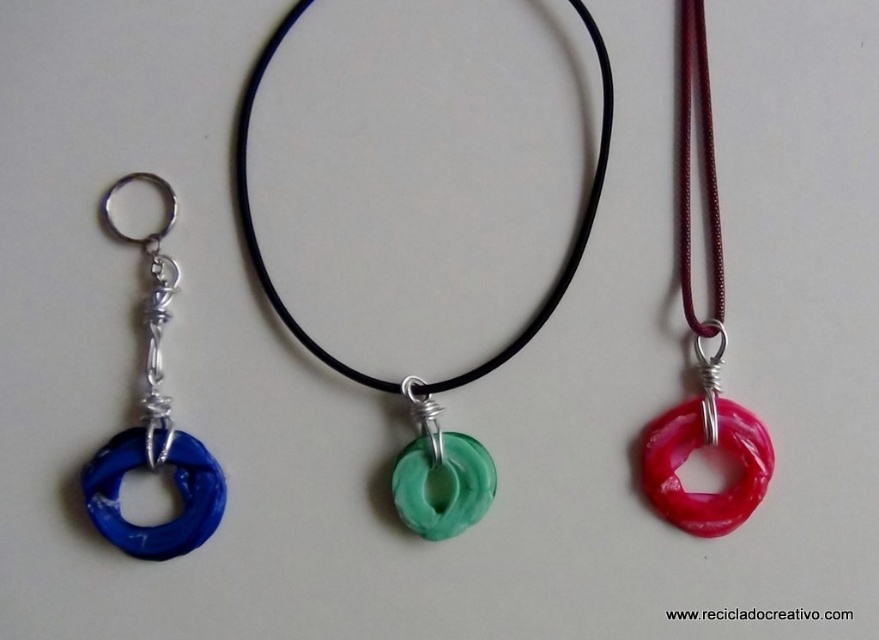
You are an online buyer who wants to know if the green translucent ring at center will fit through the loop of the blue plastic ring at left. Based on their sizes, can you determine if it will fit?

The green translucent ring at center is taller than the blue plastic ring at left, so it cannot fit through the loop of the blue plastic ring at left.

You are a customer at a jewelry store and want to know if the pink translucent ring at center and the green rubbery ring at center can be worn together on the same finger. Based on their positions in the image, can you determine if they are the same size?

The pink translucent ring at center and the green rubbery ring at center are 13.15 inches apart, so they are too far apart to be worn on the same finger. Therefore, they are likely not the same size.

You are a customer at a jewelry store. You want to buy a ring that is wider. Which one between the green translucent ring at center and the green rubbery ring at center should you choose?

The green translucent ring at center is wider than the green rubbery ring at center, so you should choose the green translucent ring at center.